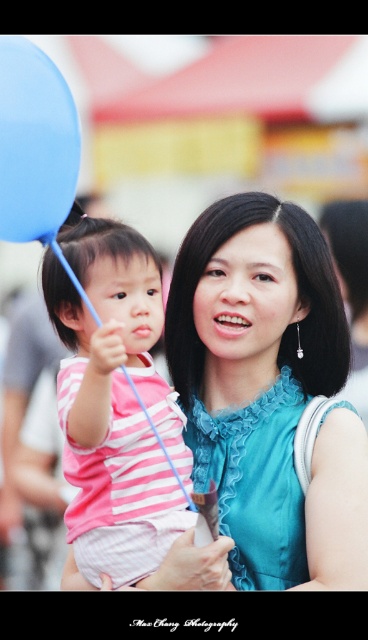
Question: Among these points, which one is nearest to the camera?

Choices:
 (A) (59, 314)
 (B) (59, 148)

Answer: (B)

Question: Among these objects, which one is farthest from the camera?

Choices:
 (A) blue rubber balloon at upper left
 (B) blue satin dress at center

Answer: (B)

Question: Does blue satin dress at center appear under blue rubber balloon at upper left?

Choices:
 (A) yes
 (B) no

Answer: (A)

Question: Is the position of blue satin dress at center less distant than that of pink striped shirt at left?

Choices:
 (A) no
 (B) yes

Answer: (A)

Question: Which point is farther to the camera?

Choices:
 (A) (164, 563)
 (B) (44, 189)

Answer: (A)

Question: Does pink striped shirt at left appear over blue rubber balloon at upper left?

Choices:
 (A) no
 (B) yes

Answer: (A)